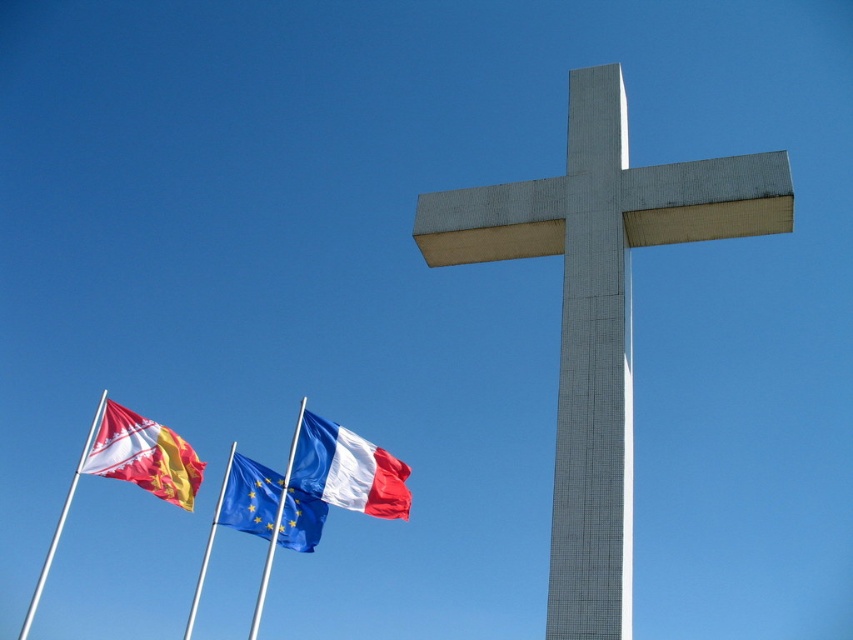
You are standing in front of the white cross structure and looking towards the three flagpoles. Which object is closer to you between the white and blue fabric flag at center and the silver metallic flag pole at left?

The white and blue fabric flag at center is closer to you because the silver metallic flag pole at left is behind it.

You are a photographer trying to capture the blue fabric flag at center and the silver metallic flag pole at left in the same frame. Which object should you focus on first if you want to ensure both are in focus?

The blue fabric flag at center is shorter than the silver metallic flag pole at left, so you should focus on the silver metallic flag pole at left first since it is farther away and requires a smaller aperture for depth of field.